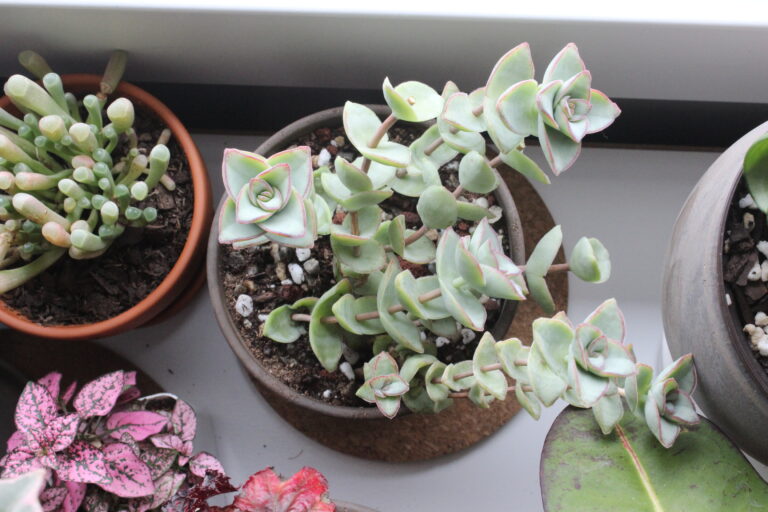
Where is `wall`? Image resolution: width=768 pixels, height=512 pixels. wall is located at coordinates (298, 46).